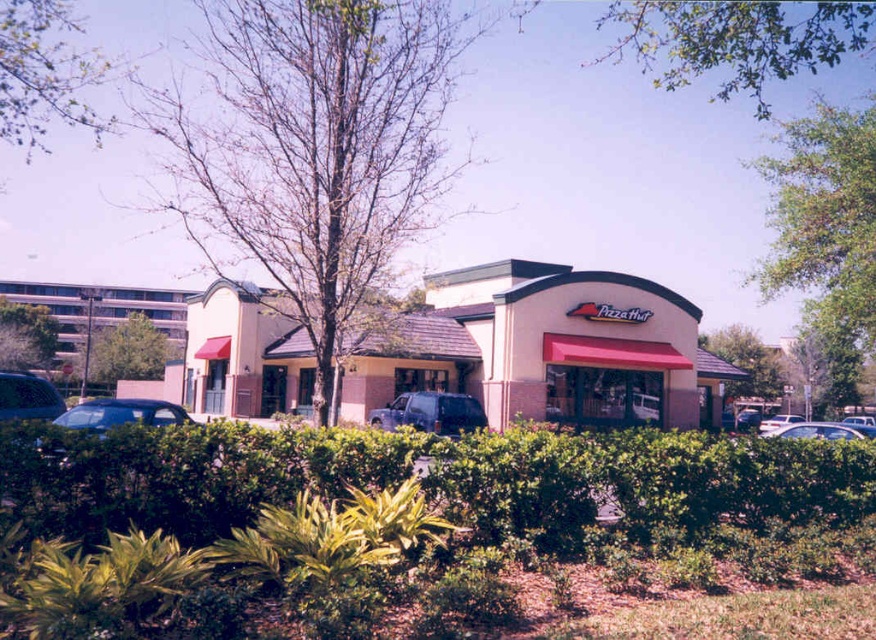
Question: Is beige stucco pizza hut at center bigger than green leafy bush at lower left?

Choices:
 (A) no
 (B) yes

Answer: (B)

Question: From the image, what is the correct spatial relationship of green leafy hedge at lower center in relation to green leafy bush at center?

Choices:
 (A) below
 (B) above

Answer: (A)

Question: Which object is the farthest from the matte black car at left?

Choices:
 (A) beige stucco pizza hut at center
 (B) white matte car at center
 (C) green leafy bush at lower left

Answer: (C)

Question: Which object is farther from the camera taking this photo?

Choices:
 (A) green leafy bush at center
 (B) matte black car at lower left
 (C) white matte car at center
 (D) green leafy bush at lower left

Answer: (A)

Question: Where is metallic silver sedan at center located in relation to white matte car at center in the image?

Choices:
 (A) below
 (B) above

Answer: (B)

Question: Which point appears farthest from the camera in this image?

Choices:
 (A) (419, 412)
 (B) (786, 417)

Answer: (B)